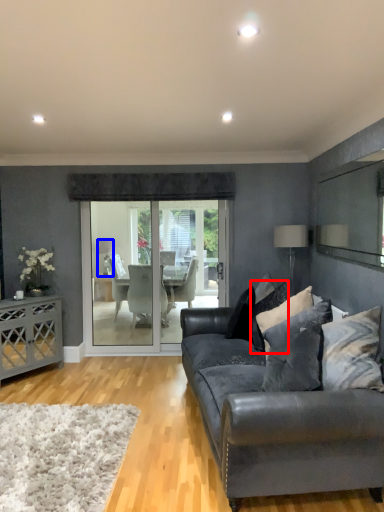
Question: Among these objects, which one is nearest to the camera, pillow (highlighted by a red box) or lamp (highlighted by a blue box)?

Choices:
 (A) pillow
 (B) lamp

Answer: (A)